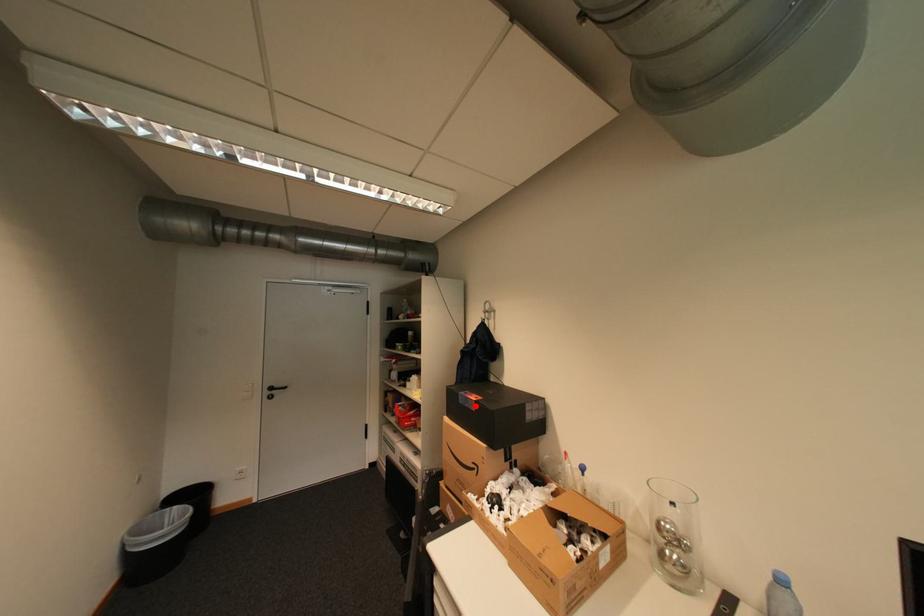
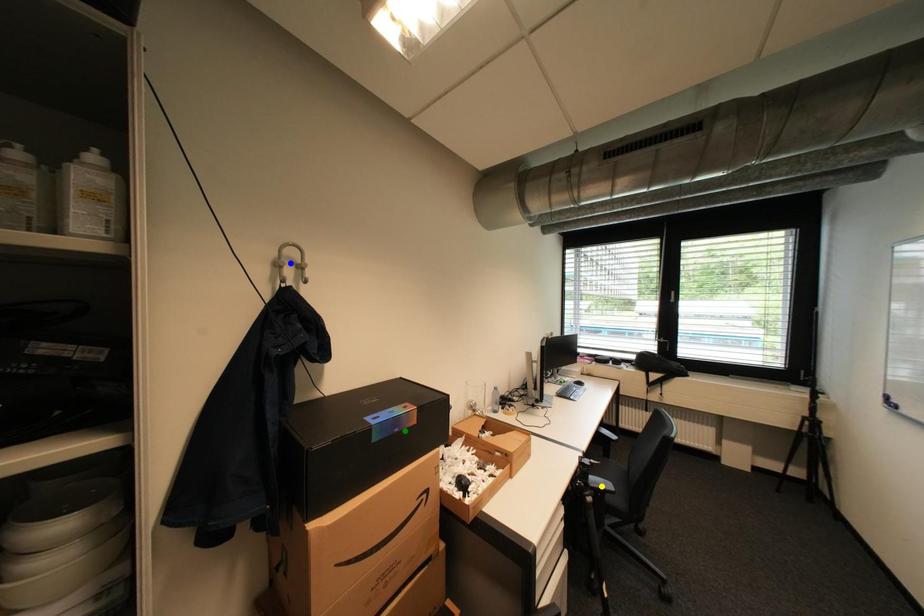
Question: I am providing you with two images of the same scene from different viewpoints. A red point is marked on the first image. You are given multiple points on the second image. In image 2, which mark is for the same physical point as the one in image 1?

Choices:
 (A) blue point
 (B) yellow point
 (C) green point

Answer: (C)